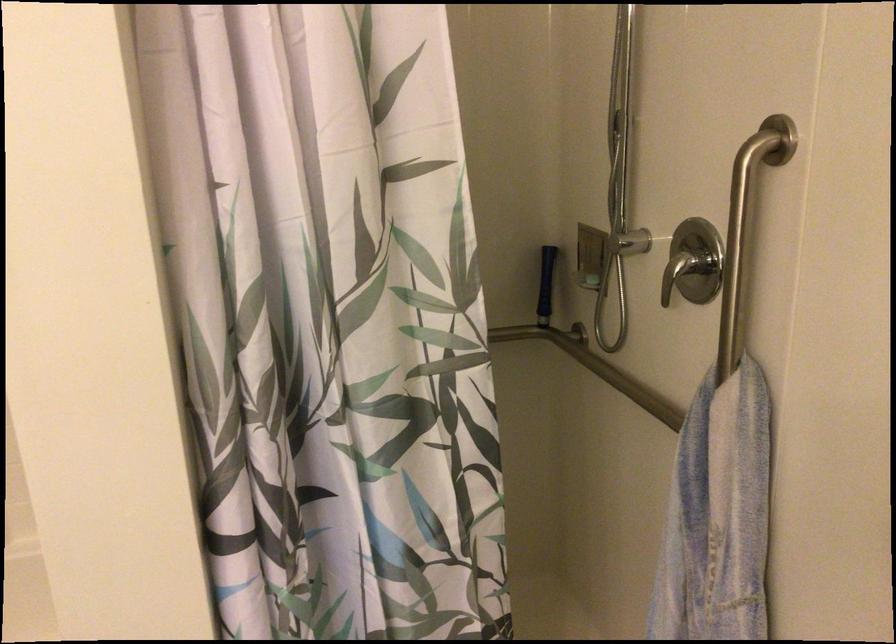
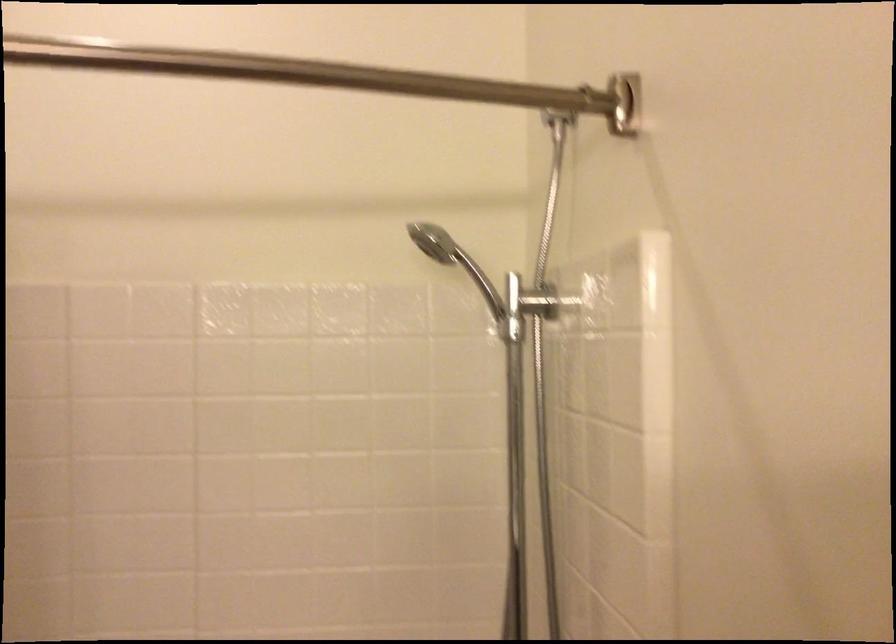
Which direction would the cameraman need to move to produce the second image?

The cameraman moved toward left, forward.